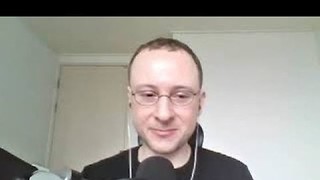
At what (x,y) coordinates should I click in order to perform the action: click on door. Please return your answer as a coordinate pair (x, y). Looking at the image, I should click on (101, 110).